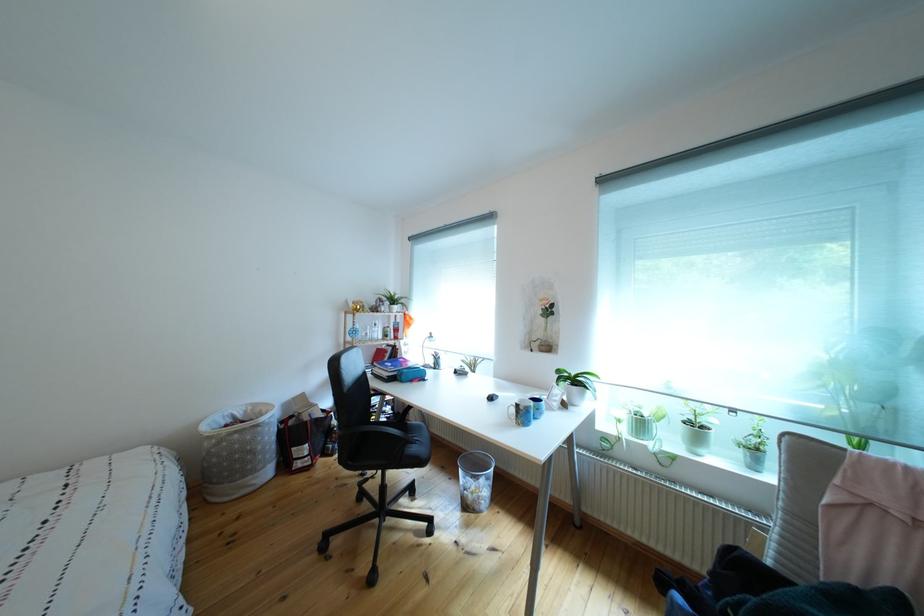
The height and width of the screenshot is (616, 924). I want to click on mesh trash can, so click(x=237, y=450).